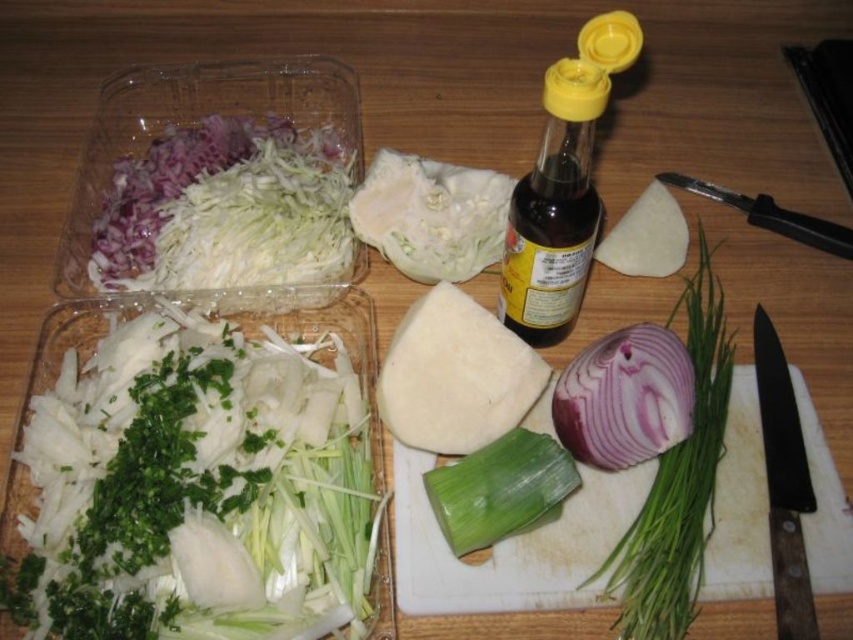
Can you confirm if white plastic cutting board at center is thinner than white soft cheese at center?

Incorrect, white plastic cutting board at center's width is not less than white soft cheese at center's.

Is point (395, 576) more distant than point (496, 388)?

No, (395, 576) is closer to viewer.

Locate an element on the screen. The width and height of the screenshot is (853, 640). white plastic cutting board at center is located at coordinates (509, 547).

From the picture: Is white leafy object at center to the left of black wooden handle knife at right from the viewer's perspective?

Correct, you'll find white leafy object at center to the left of black wooden handle knife at right.

Who is shorter, white leafy object at center or black wooden handle knife at right?

Standing shorter between the two is white leafy object at center.

Based on the photo, who is more forward, (456, 180) or (788, 467)?

Point (788, 467) is in front.

Where is `white leafy object at center`? white leafy object at center is located at coordinates (431, 216).

Does purple translucent onion at center-right have a greater width compared to black wooden handle knife at right?

Yes.

Who is more distant from viewer, (595, 465) or (755, 308)?

The point (755, 308) is more distant.

Where is `purple translucent onion at center-right`? This screenshot has width=853, height=640. purple translucent onion at center-right is located at coordinates (625, 397).